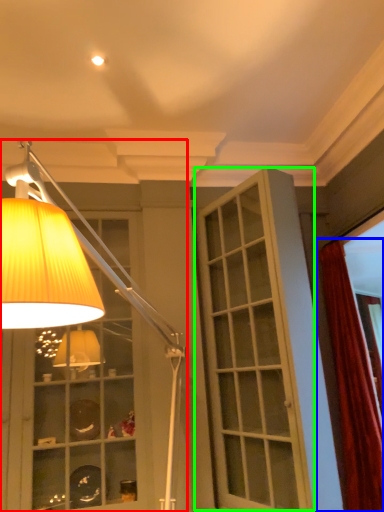
Question: Estimate the real-world distances between objects in this image. Which object is farther from lamp (highlighted by a red box), curtain (highlighted by a blue box) or screen door (highlighted by a green box)?

Choices:
 (A) curtain
 (B) screen door

Answer: (A)